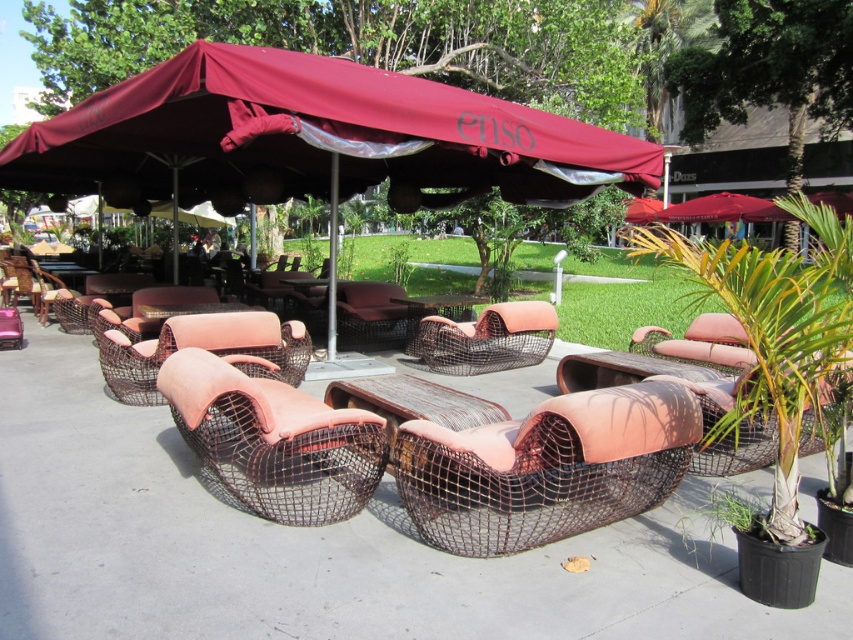
Question: Considering the real-world distances, which object is closest to the brown woven table at center?

Choices:
 (A) rustic woven armchair at center
 (B) rattan wicker armchair at center
 (C) rustic wicker armchair at center
 (D) maroon fabric canopy at upper center

Answer: (B)

Question: Among these objects, which one is nearest to the camera?

Choices:
 (A) rustic wicker armchair at center
 (B) rustic wicker table at center

Answer: (A)

Question: Can you confirm if rattan wicker armchair at center is thinner than rustic wicker table at center?

Choices:
 (A) no
 (B) yes

Answer: (A)

Question: Which point is farther to the camera?

Choices:
 (A) brown woven table at center
 (B) maroon fabric canopy at upper center
 (C) brown woven armchair at center

Answer: (A)

Question: Is the position of rustic woven armchair at center more distant than that of rustic wicker armchair at center?

Choices:
 (A) yes
 (B) no

Answer: (B)

Question: Does rustic wicker armchair at center come behind rustic wicker table at center?

Choices:
 (A) no
 (B) yes

Answer: (A)